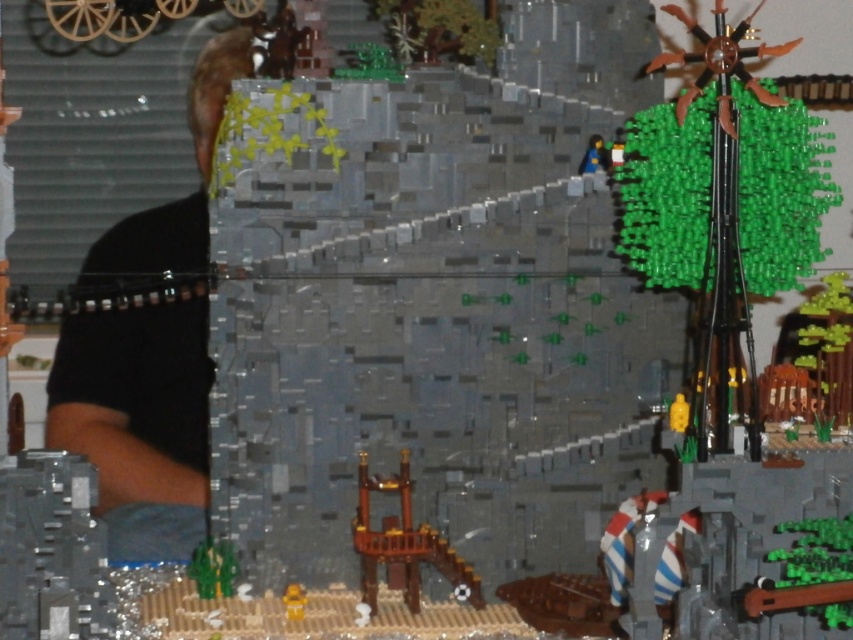
You are a visitor approaching the LEGO fortress and notice two figures on the bridge. The black matte shirt at left and the yellow matte figure at lower center. Which figure appears taller from your viewing angle?

The black matte shirt at left appears taller than the yellow matte figure at lower center.

You are a visitor approaching the LEGO fortress and notice two figures on the wooden bridge. The black matte shirt at left and the yellow matte figure at lower center. From your perspective, which figure is positioned higher?

The black matte shirt at left is above the yellow matte figure at lower center, so it is positioned higher.

You are a LEGO figure trying to cross the bridge. You see the brown wooden tower at center and the yellow matte figure at lower center. Which object is wider? Please answer based on their widths.

The brown wooden tower at center is wider than the yellow matte figure at lower center.